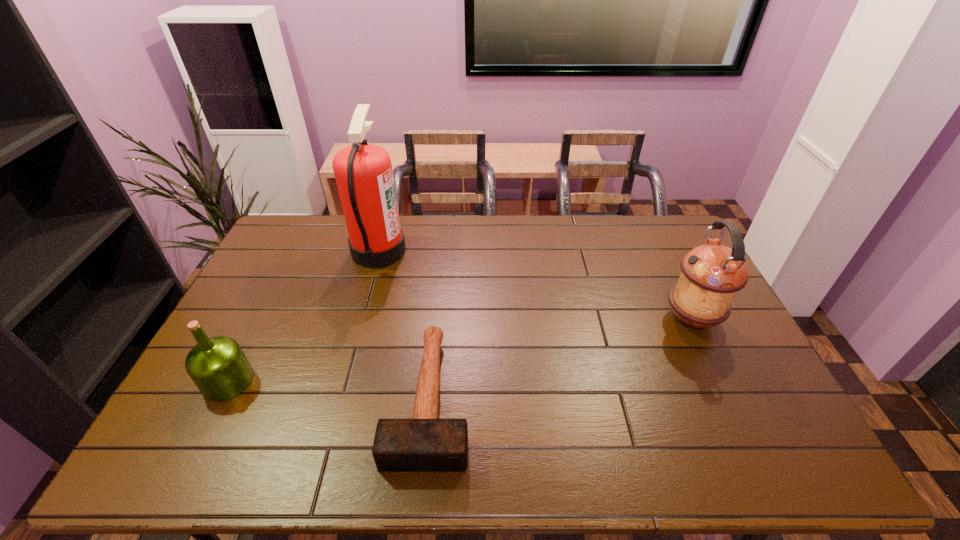
The image size is (960, 540). In order to click on free spot located 0.170m on the right of the olive oil in this screenshot , I will do `click(315, 381)`.

At what (x,y) coordinates should I click in order to perform the action: click on object located in the far edge section of the desktop. Please return your answer as a coordinate pair (x, y). Looking at the image, I should click on 363,172.

Where is `object that is at the near edge`? The width and height of the screenshot is (960, 540). object that is at the near edge is located at coordinates (423, 444).

This screenshot has height=540, width=960. Identify the location of object located at the left edge. (218, 366).

You are a GUI agent. You are given a task and a screenshot of the screen. Output one action in this format:
    pyautogui.click(x=<x>, y=<y>)
    Task: Click on the object located at the right edge
    
    Given the screenshot: What is the action you would take?
    pyautogui.click(x=711, y=275)

The height and width of the screenshot is (540, 960). In order to click on vacant region at the far edge of the desktop in this screenshot , I will do `click(547, 250)`.

Find the location of `vacant region at the near edge of the desktop`. vacant region at the near edge of the desktop is located at coordinates (293, 437).

Identify the location of free location at the left edge of the desktop. (288, 293).

The height and width of the screenshot is (540, 960). I want to click on vacant space at the right edge of the desktop, so click(x=679, y=274).

Where is `vacant region at the far right corner of the desktop`? vacant region at the far right corner of the desktop is located at coordinates (682, 252).